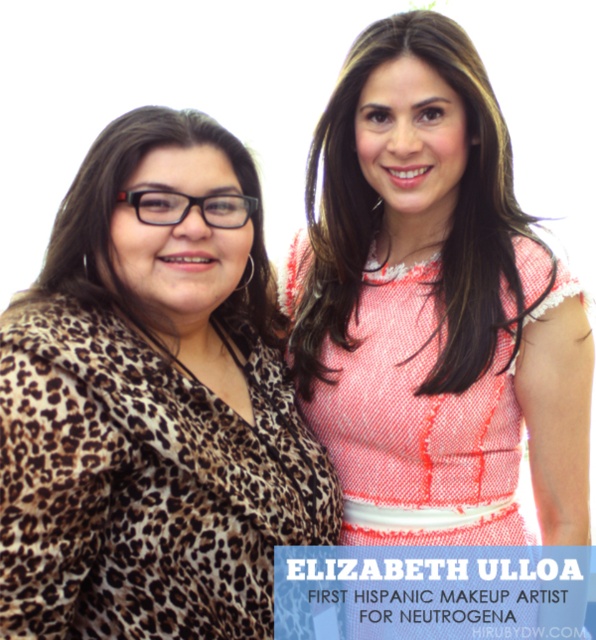
Between point (190, 122) and point (485, 241), which one is positioned behind?

Point (485, 241)

Based on the photo, is leopard print coat at left taller than pink textured dress at center?

No.

Is point (195, 128) closer to viewer compared to point (455, 230)?

Yes, it is in front of point (455, 230).

Image resolution: width=596 pixels, height=640 pixels. I want to click on leopard print coat at left, so click(x=153, y=403).